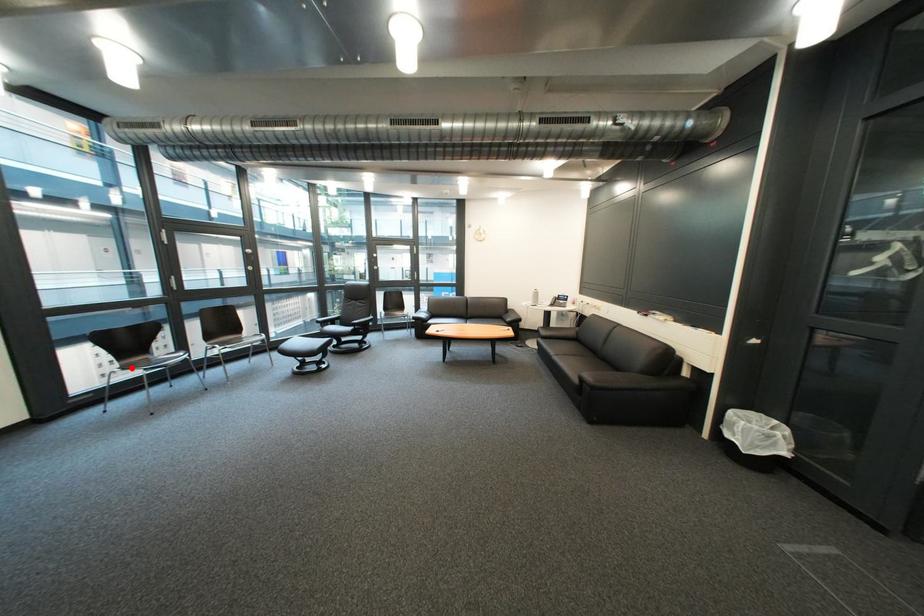
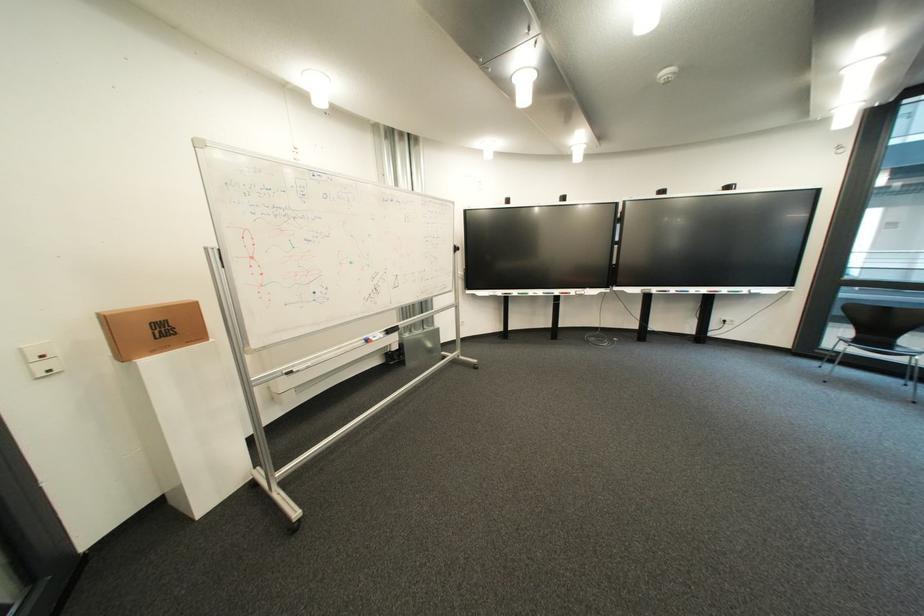
Question: I am providing you with two images of the same scene from different viewpoints. A red point is marked on the first image. Is the red point's position out of view in image 2?

Choices:
 (A) Yes
 (B) No

Answer: (A)